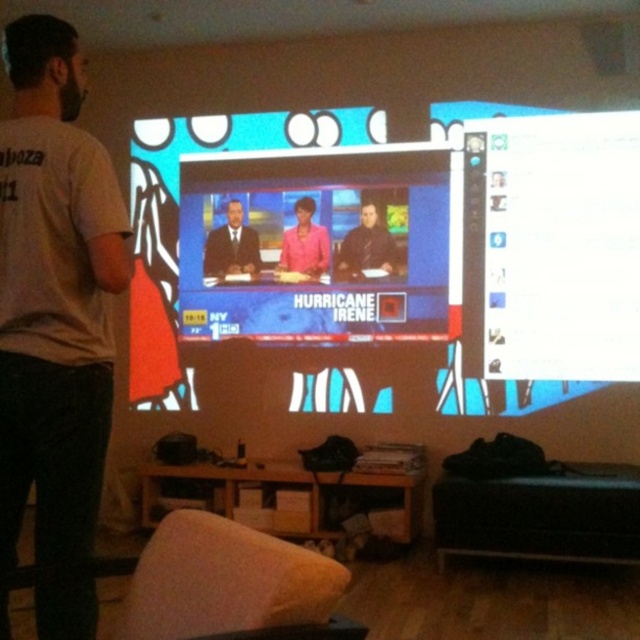
Question: Which point is farther to the camera?

Choices:
 (A) (349, 230)
 (B) (36, 262)
 (C) (308, 221)

Answer: (C)

Question: Does matte plastic tv screen at center have a lesser width compared to white glossy screen at upper right?

Choices:
 (A) yes
 (B) no

Answer: (B)

Question: Among these objects, which one is farthest from the camera?

Choices:
 (A) white glossy screen at upper right
 (B) brown textured shirt at center
 (C) gray cotton t-shirt at left

Answer: (B)

Question: Which object is closer to the camera taking this photo?

Choices:
 (A) brown textured shirt at center
 (B) white glossy screen at upper right
 (C) gray cotton t-shirt at left
 (D) smooth suit at center

Answer: (C)

Question: Can you confirm if matte plastic tv screen at center is thinner than pink fabric at center?

Choices:
 (A) no
 (B) yes

Answer: (A)

Question: Does matte plastic tv screen at center have a larger size compared to white glossy screen at upper right?

Choices:
 (A) yes
 (B) no

Answer: (A)